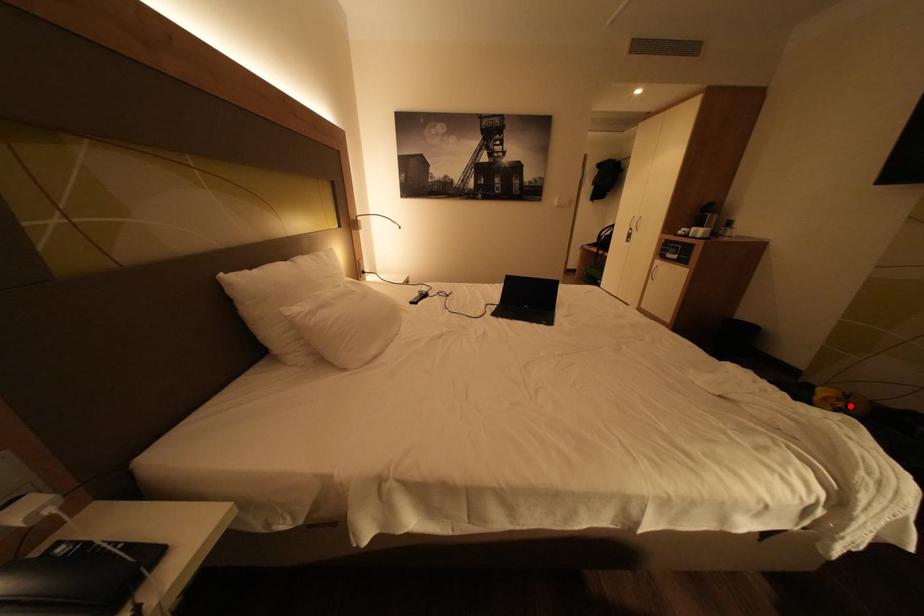
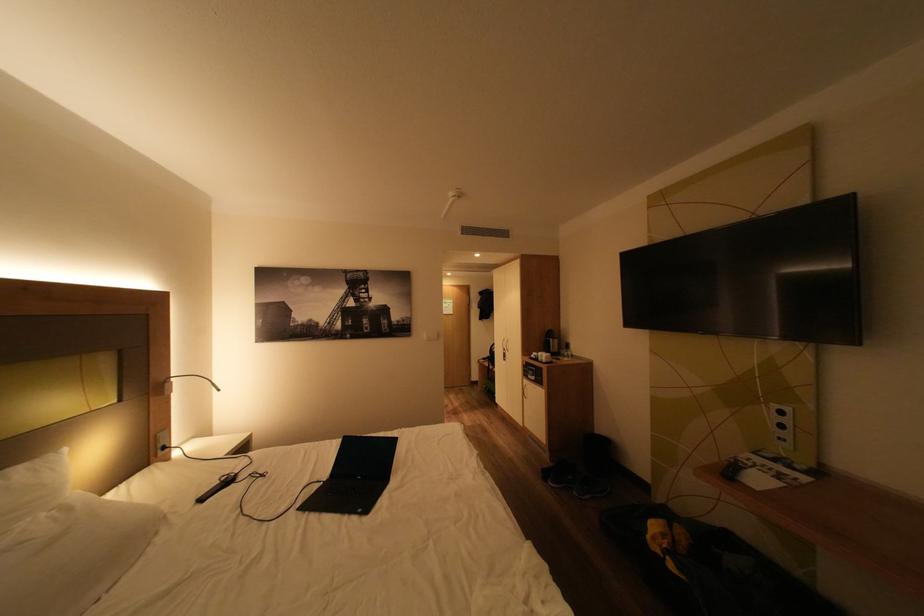
Find the pixel in the second image that matches the highlighted location in the first image.

(675, 546)